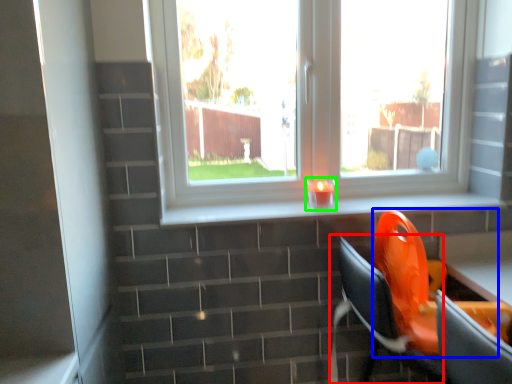
Question: Based on their relative distances, which object is nearer to computer chair (highlighted by a red box)? Choose from swivel chair (highlighted by a blue box) and candle holder (highlighted by a green box).

Choices:
 (A) swivel chair
 (B) candle holder

Answer: (A)